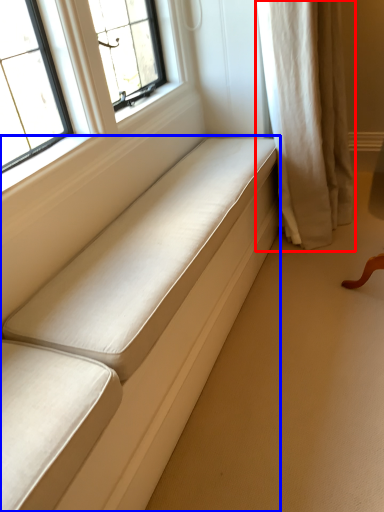
Question: Which of the following is the farthest to the observer, curtain (highlighted by a red box) or furniture (highlighted by a blue box)?

Choices:
 (A) curtain
 (B) furniture

Answer: (A)